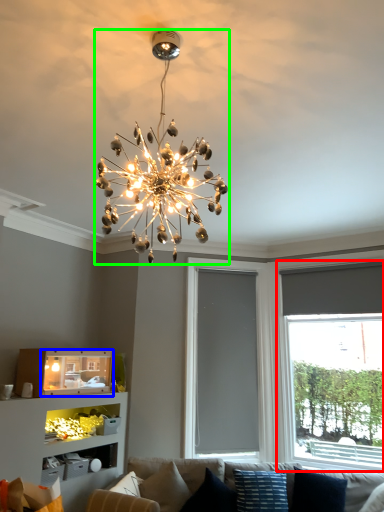
Question: Based on their relative distances, which object is farther from window (highlighted by a red box)? Choose from shelf (highlighted by a blue box) and lamp (highlighted by a green box).

Choices:
 (A) shelf
 (B) lamp

Answer: (B)